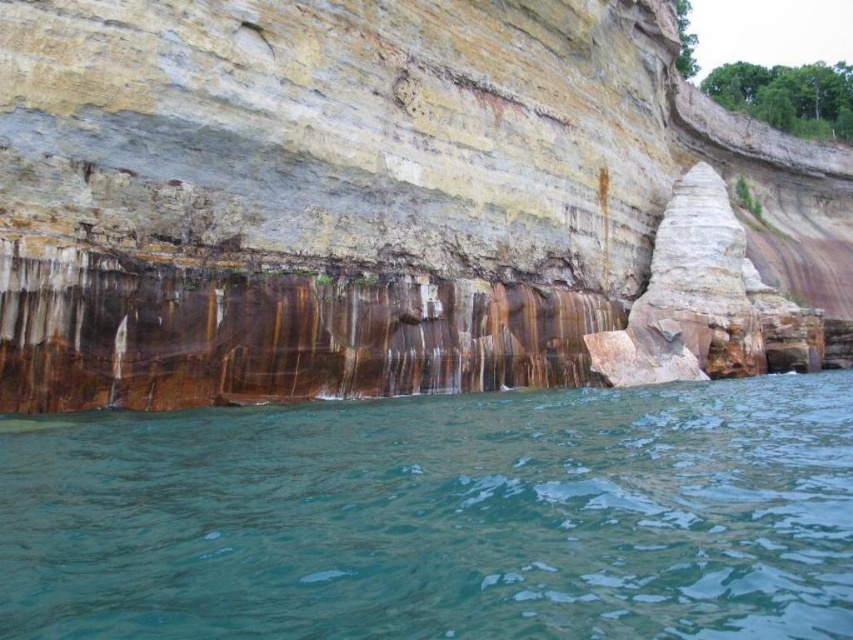
Measure the distance between rusty metallic rock at center and green translucent water at lower center.

A distance of 33.77 meters exists between rusty metallic rock at center and green translucent water at lower center.

Which is behind, point (115, 104) or point (801, 556)?

Positioned behind is point (115, 104).

At what (x,y) coordinates should I click in order to perform the action: click on rusty metallic rock at center. Please return your answer as a coordinate pair (x, y). Looking at the image, I should click on (390, 204).